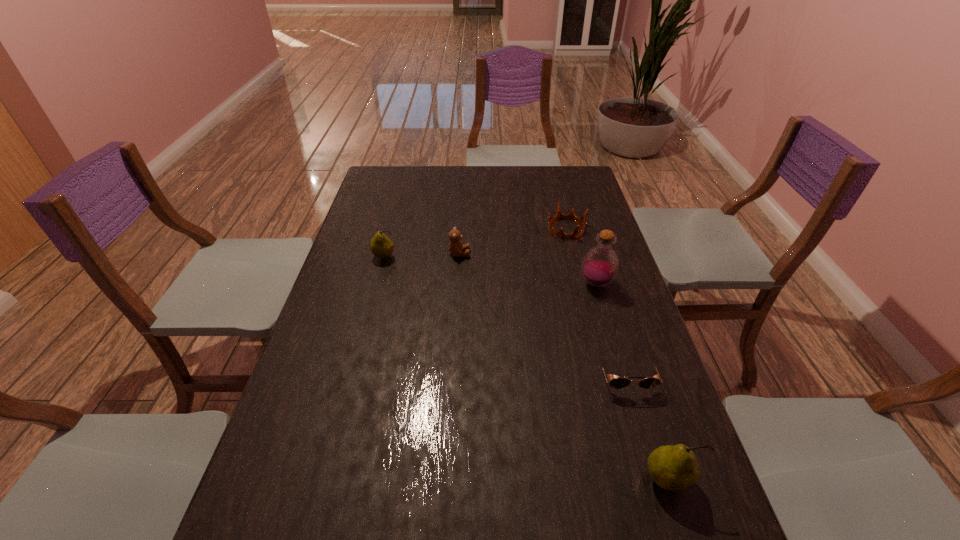
The image size is (960, 540). I want to click on free space between the bottle and the shorter pear, so click(491, 270).

Locate an element on the screen. The height and width of the screenshot is (540, 960). unoccupied position between the nearer pear and the crown is located at coordinates (617, 354).

Where is `free point between the fourth farthest object and the sunglasses`? This screenshot has width=960, height=540. free point between the fourth farthest object and the sunglasses is located at coordinates (611, 329).

At what (x,y) coordinates should I click in order to perform the action: click on vacant area between the taller pear and the leftmost object. Please return your answer as a coordinate pair (x, y). Image resolution: width=960 pixels, height=540 pixels. Looking at the image, I should click on (526, 368).

Where is `free space between the farthest object and the nearest object`? Image resolution: width=960 pixels, height=540 pixels. free space between the farthest object and the nearest object is located at coordinates (617, 354).

Identify the location of free space between the farthest object and the sunglasses. The width and height of the screenshot is (960, 540). (595, 301).

This screenshot has width=960, height=540. Find the location of `free space between the fifth farthest object and the nearest object`. free space between the fifth farthest object and the nearest object is located at coordinates (646, 427).

Locate an element on the screen. free space that is in between the bottle and the fifth farthest object is located at coordinates tap(611, 329).

Where is `free space between the farthest object and the nearest object`? This screenshot has height=540, width=960. free space between the farthest object and the nearest object is located at coordinates (617, 354).

I want to click on vacant area that lies between the crown and the bottle, so click(581, 256).